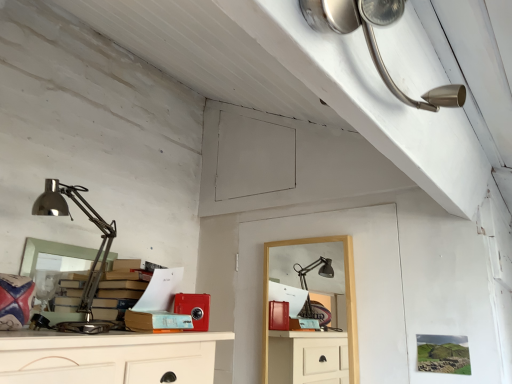
The width and height of the screenshot is (512, 384). In order to click on wooden desk at center in this screenshot , I will do `click(345, 293)`.

Consider the image. What is the approximate width of wooden desk at center?

4.33 centimeters.

What do you see at coordinates (376, 41) in the screenshot? I see `satin nickel lamp at upper right, the second lamp from the bottom` at bounding box center [376, 41].

Where is `polished metal desk lamp at left, which is counted as the 2th lamp, starting from the front`? The image size is (512, 384). polished metal desk lamp at left, which is counted as the 2th lamp, starting from the front is located at coordinates (71, 218).

Is satin nickel lamp at upper right, the second lamp from the bottom, aimed at wooden desk at center?

No, satin nickel lamp at upper right, the second lamp from the bottom, is not turned towards wooden desk at center.

Considering the relative positions of satin nickel lamp at upper right, arranged as the 1th lamp when viewed from the front, and wooden desk at center in the image provided, is satin nickel lamp at upper right, arranged as the 1th lamp when viewed from the front, to the right of wooden desk at center from the viewer's perspective?

Yes, satin nickel lamp at upper right, arranged as the 1th lamp when viewed from the front, is to the right of wooden desk at center.

Do you think satin nickel lamp at upper right, arranged as the 1th lamp when viewed from the front, is within wooden desk at center, or outside of it?

satin nickel lamp at upper right, arranged as the 1th lamp when viewed from the front, cannot be found inside wooden desk at center.

Does satin nickel lamp at upper right, the 2th lamp viewed from the left, have a smaller size compared to wooden desk at center?

Yes, satin nickel lamp at upper right, the 2th lamp viewed from the left, is smaller than wooden desk at center.

Can you confirm if polished metal desk lamp at left, marked as the second lamp in a right-to-left arrangement, is positioned to the right of satin nickel lamp at upper right, arranged as the 1th lamp when viewed from the front?

No, polished metal desk lamp at left, marked as the second lamp in a right-to-left arrangement, is not to the right of satin nickel lamp at upper right, arranged as the 1th lamp when viewed from the front.

At what (x,y) coordinates should I click in order to perform the action: click on lamp located underneath the satin nickel lamp at upper right, the second lamp from the bottom (from a real-world perspective). Please return your answer as a coordinate pair (x, y). Looking at the image, I should click on (71, 218).

Based on their sizes in the image, would you say polished metal desk lamp at left, which is counted as the 2th lamp, starting from the front, is bigger or smaller than satin nickel lamp at upper right, the 2th lamp when ordered from back to front?

Considering their sizes, polished metal desk lamp at left, which is counted as the 2th lamp, starting from the front, takes up more space than satin nickel lamp at upper right, the 2th lamp when ordered from back to front.

From the image's perspective, is wooden desk at center located above satin nickel lamp at upper right, the 2th lamp viewed from the left?

No, from the image's perspective, wooden desk at center is not above satin nickel lamp at upper right, the 2th lamp viewed from the left.

Between point (356, 347) and point (445, 86), which one is positioned behind?

The point (356, 347) is farther from the camera.

From a real-world perspective, count 2nd lamps upward from the wooden desk at center and point to it. Please provide its 2D coordinates.

[(376, 41)]

Does wooden desk at center have a lesser height compared to satin nickel lamp at upper right, the 1th lamp when ordered from right to left?

Incorrect, the height of wooden desk at center does not fall short of that of satin nickel lamp at upper right, the 1th lamp when ordered from right to left.

Can you confirm if polished metal desk lamp at left, which is the first lamp from bottom to top, is shorter than wooden desk at center?

Yes, polished metal desk lamp at left, which is the first lamp from bottom to top, is shorter than wooden desk at center.

From the image's perspective, which object appears higher, polished metal desk lamp at left, which is the first lamp from bottom to top, or wooden desk at center?

polished metal desk lamp at left, which is the first lamp from bottom to top.

Looking at their sizes, would you say polished metal desk lamp at left, which ranks as the 1th lamp in left-to-right order, is wider or thinner than wooden desk at center?

polished metal desk lamp at left, which ranks as the 1th lamp in left-to-right order, is wider than wooden desk at center.

At what (x,y) coordinates should I click in order to perform the action: click on lamp on the left of wooden desk at center. Please return your answer as a coordinate pair (x, y). This screenshot has width=512, height=384. Looking at the image, I should click on (71, 218).

From the picture: Can you confirm if satin nickel lamp at upper right, the 2th lamp when ordered from back to front, is positioned to the right of polished metal desk lamp at left, which is the first lamp from bottom to top?

Indeed, satin nickel lamp at upper right, the 2th lamp when ordered from back to front, is positioned on the right side of polished metal desk lamp at left, which is the first lamp from bottom to top.

Is satin nickel lamp at upper right, the 2th lamp viewed from the left, far away from polished metal desk lamp at left, which ranks as the 1th lamp in left-to-right order?

Yes, satin nickel lamp at upper right, the 2th lamp viewed from the left, and polished metal desk lamp at left, which ranks as the 1th lamp in left-to-right order, are located far from each other.

Which is behind, satin nickel lamp at upper right, the first lamp in the top-to-bottom sequence, or polished metal desk lamp at left, which is the 2th lamp from top to bottom?

polished metal desk lamp at left, which is the 2th lamp from top to bottom, is behind.

Which of these two, satin nickel lamp at upper right, the second lamp from the bottom, or polished metal desk lamp at left, which ranks as the 1th lamp in left-to-right order, is wider?

With larger width is polished metal desk lamp at left, which ranks as the 1th lamp in left-to-right order.

Is wooden desk at center thinner than polished metal desk lamp at left, which is the first lamp from bottom to top?

Correct, the width of wooden desk at center is less than that of polished metal desk lamp at left, which is the first lamp from bottom to top.

From a real-world perspective, which object stands above the other?

In real-world perspective, polished metal desk lamp at left, which is the first lamp from bottom to top, is above.

Is wooden desk at center to the left of polished metal desk lamp at left, which is the first lamp from bottom to top, from the viewer's perspective?

In fact, wooden desk at center is to the right of polished metal desk lamp at left, which is the first lamp from bottom to top.

Is there a large distance between wooden desk at center and polished metal desk lamp at left, which is counted as the 2th lamp, starting from the front?

That's not correct — wooden desk at center is a little close to polished metal desk lamp at left, which is counted as the 2th lamp, starting from the front.

From a real-world perspective, count 2nd lamps upward from the wooden desk at center and point to it. Please provide its 2D coordinates.

[(376, 41)]

Identify the location of lamp that appears below the satin nickel lamp at upper right, the first lamp in the top-to-bottom sequence (from a real-world perspective). (71, 218).

Which object lies nearer to the anchor point wooden desk at center, satin nickel lamp at upper right, the 2th lamp viewed from the left, or polished metal desk lamp at left, marked as the first lamp in a back-to-front arrangement?

Among the two, polished metal desk lamp at left, marked as the first lamp in a back-to-front arrangement, is located nearer to wooden desk at center.

Considering their positions, is satin nickel lamp at upper right, the first lamp in the top-to-bottom sequence, positioned closer to polished metal desk lamp at left, which ranks as the 1th lamp in left-to-right order, than wooden desk at center?

wooden desk at center lies closer to polished metal desk lamp at left, which ranks as the 1th lamp in left-to-right order, than the other object.

Which object lies nearer to the anchor point wooden desk at center, polished metal desk lamp at left, which ranks as the 1th lamp in left-to-right order, or satin nickel lamp at upper right, the second lamp from the bottom?

polished metal desk lamp at left, which ranks as the 1th lamp in left-to-right order, lies closer to wooden desk at center than the other object.

From the image, which object appears to be farther from satin nickel lamp at upper right, arranged as the 1th lamp when viewed from the front, polished metal desk lamp at left, marked as the second lamp in a right-to-left arrangement, or wooden desk at center?

Based on the image, polished metal desk lamp at left, marked as the second lamp in a right-to-left arrangement, appears to be further to satin nickel lamp at upper right, arranged as the 1th lamp when viewed from the front.

Based on their spatial positions, is wooden desk at center or satin nickel lamp at upper right, the 2th lamp when ordered from back to front, closer to polished metal desk lamp at left, which is the 2th lamp from top to bottom?

Among the two, wooden desk at center is located nearer to polished metal desk lamp at left, which is the 2th lamp from top to bottom.

From the image, which object appears to be farther from satin nickel lamp at upper right, the 1th lamp when ordered from right to left, wooden desk at center or polished metal desk lamp at left, marked as the second lamp in a right-to-left arrangement?

polished metal desk lamp at left, marked as the second lamp in a right-to-left arrangement, is further to satin nickel lamp at upper right, the 1th lamp when ordered from right to left.

Find the location of a particular element. The image size is (512, 384). lamp between satin nickel lamp at upper right, arranged as the 1th lamp when viewed from the front, and wooden desk at center from front to back is located at coordinates (71, 218).